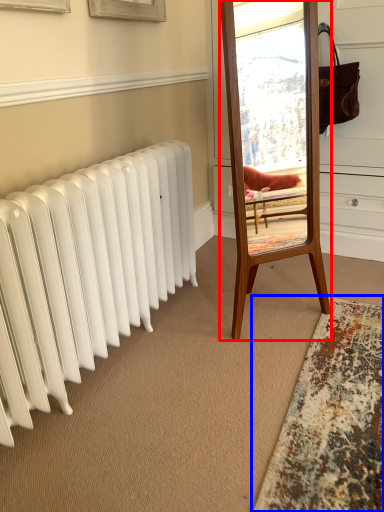
Question: Among these objects, which one is farthest to the camera, mirror (highlighted by a red box) or mat (highlighted by a blue box)?

Choices:
 (A) mirror
 (B) mat

Answer: (A)